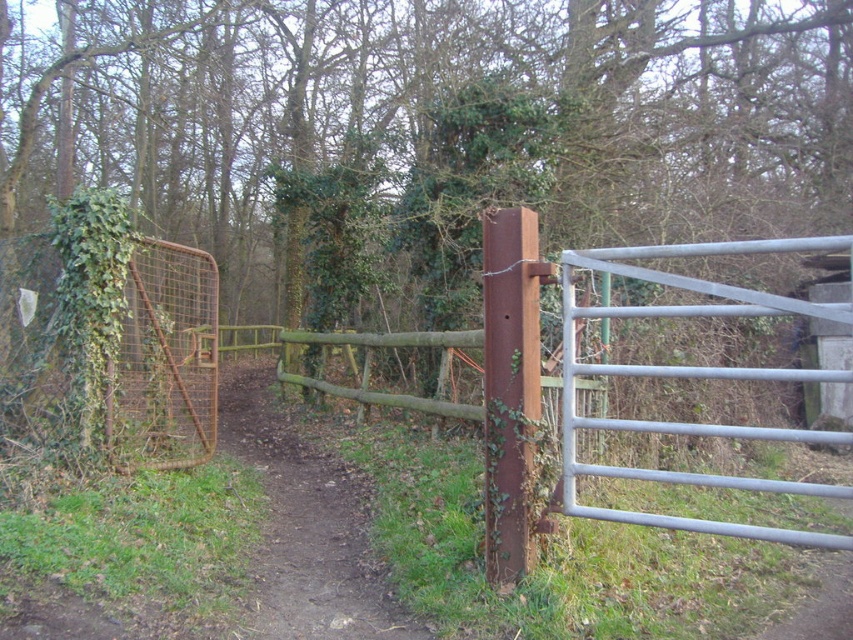
Question: Based on their relative distances, which object is farther from the brown dirt path at center?

Choices:
 (A) rusty metal gate at center
 (B) green ivy-covered tree at center

Answer: (B)

Question: Which point is closer to the camera?

Choices:
 (A) rusty metal gate at center
 (B) brown dirt path at center

Answer: (A)

Question: Is rusty metal gate at center below brown dirt path at center?

Choices:
 (A) yes
 (B) no

Answer: (B)

Question: Is rusty metal gate at center in front of brown dirt path at center?

Choices:
 (A) yes
 (B) no

Answer: (A)

Question: Which object is farther from the camera taking this photo?

Choices:
 (A) rusty metal gate at center
 (B) brown dirt path at center

Answer: (B)

Question: Is green ivy-covered tree at center below rusty metal gate at center?

Choices:
 (A) no
 (B) yes

Answer: (A)